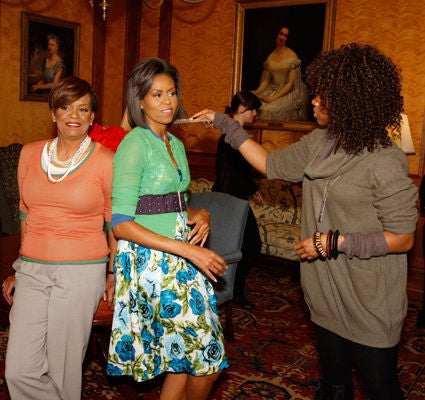
Locate an element on the screen. This screenshot has height=400, width=425. oriental rug is located at coordinates (277, 364).